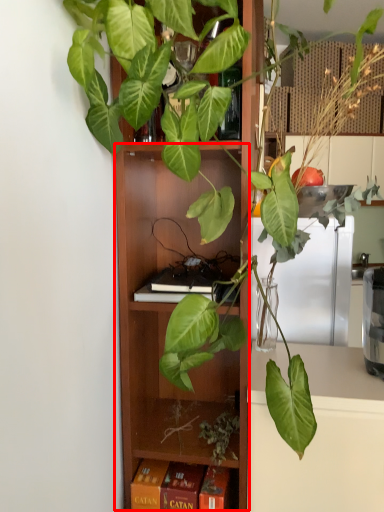
Question: From the image's perspective, what is the correct spatial positioning of cabinet (annotated by the red box) in reference to paperback book?

Choices:
 (A) above
 (B) below

Answer: (A)